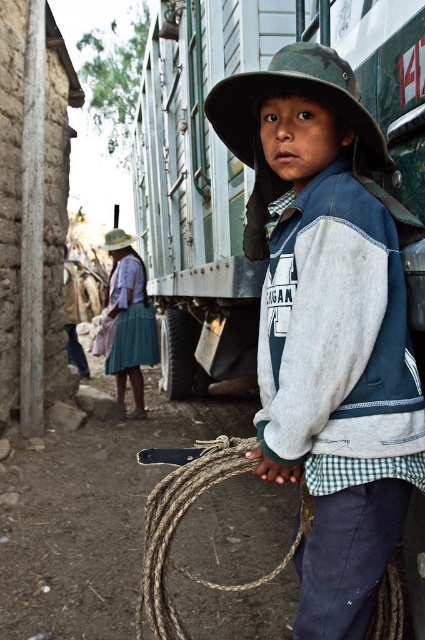
Based on the scene description, what is the 2D coordinate of the green painted metal train car at center?

The green painted metal train car at center is located at the 2D coordinate point of (198,186).

You are a delivery driver who needs to secure a package using the brown rough rope at lower center. The package is placed at point 0.806, 0.433. Can you reach the rope from your current position at point 0.5, 0.5?

The brown rough rope at lower center is exactly at the same position as the package, so yes, you can reach it easily.